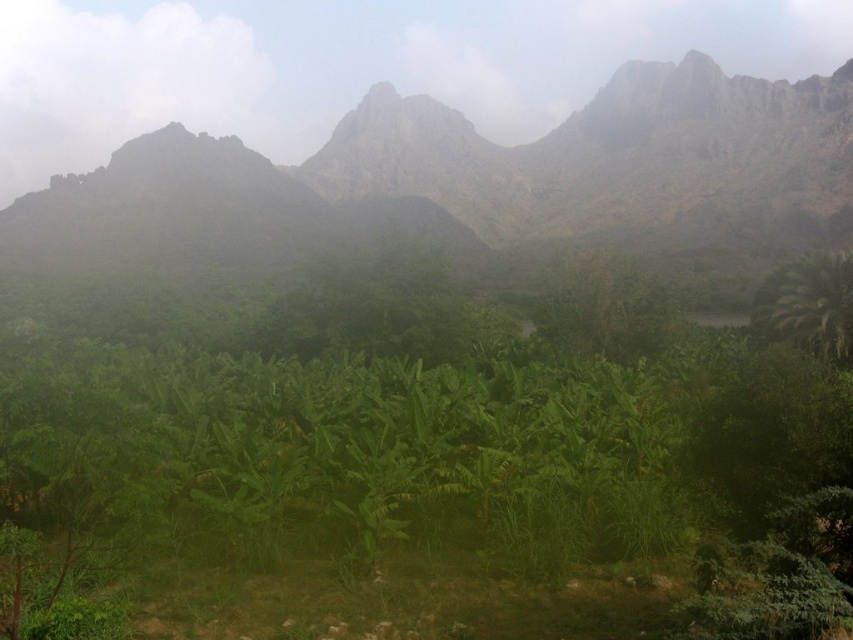
Question: From the image, what is the correct spatial relationship of rugged stone mountain range at upper center in relation to green leafy palm at right?

Choices:
 (A) above
 (B) below

Answer: (A)

Question: Can you confirm if rugged stone mountain range at upper center is positioned to the right of green leafy palm at right?

Choices:
 (A) yes
 (B) no

Answer: (B)

Question: Which of the following is the farthest from the observer?

Choices:
 (A) green leafy palm at right
 (B) rugged stone mountain range at upper center

Answer: (B)

Question: Is rugged stone mountain range at upper center to the left of green leafy palm at right from the viewer's perspective?

Choices:
 (A) yes
 (B) no

Answer: (A)

Question: Which of the following is the closest to the observer?

Choices:
 (A) (782, 212)
 (B) (834, 342)

Answer: (B)